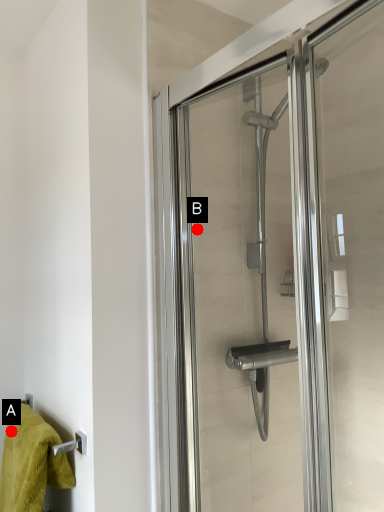
Question: Two points are circled on the image, labeled by A and B beside each circle. Which point is farther from the camera taking this photo?

Choices:
 (A) A is further
 (B) B is further

Answer: (B)